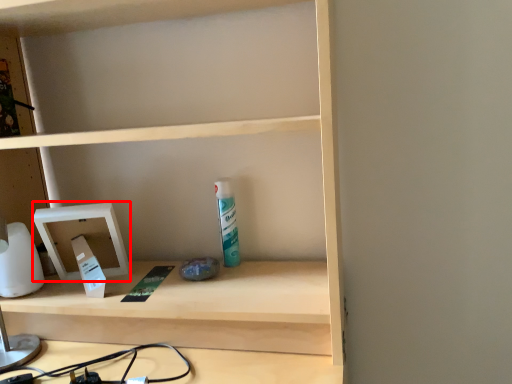
Question: From the image's perspective, what is the correct spatial relationship of medicine cabinet (annotated by the red box) in relation to toiletry?

Choices:
 (A) below
 (B) above

Answer: (A)